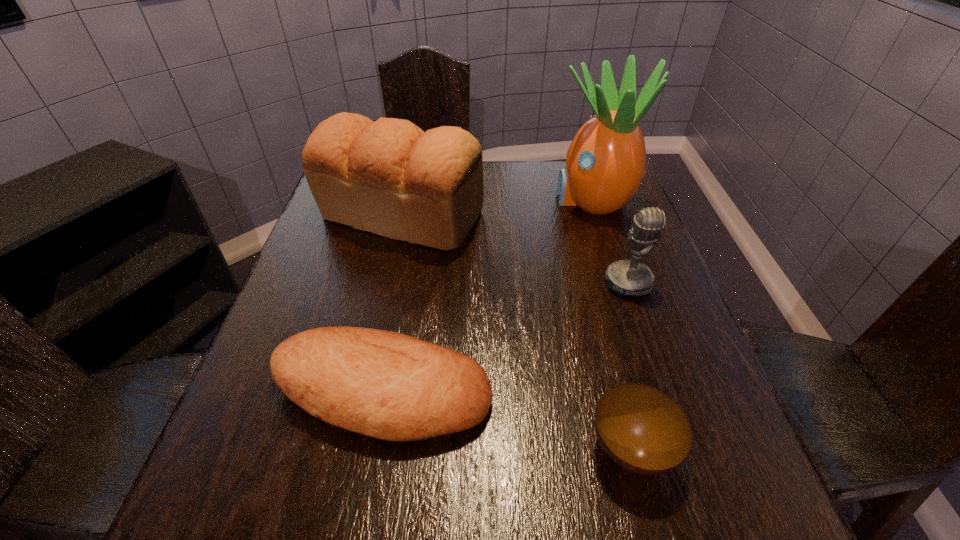
Where is `bowl that is at the right edge`? bowl that is at the right edge is located at coordinates (641, 429).

Identify the location of object positioned at the far left corner. (389, 177).

This screenshot has width=960, height=540. In order to click on object positioned at the far right corner in this screenshot , I will do [x=606, y=162].

What are the coordinates of `object at the near right corner` in the screenshot? It's located at (641, 429).

I want to click on free point at the far edge, so click(x=501, y=186).

At what (x,y) coordinates should I click in order to perform the action: click on vacant space at the near edge of the desktop. Please return your answer as a coordinate pair (x, y). Looking at the image, I should click on (376, 525).

Where is `free space at the left edge of the desktop`? The image size is (960, 540). free space at the left edge of the desktop is located at coordinates (337, 236).

Where is `vacant space at the right edge of the desktop`? vacant space at the right edge of the desktop is located at coordinates (645, 261).

I want to click on blank region between the nearer bread and the taller bread, so click(x=392, y=304).

You are a GUI agent. You are given a task and a screenshot of the screen. Output one action in this format:
    pyautogui.click(x=<x>, y=<y>)
    Task: Click on the free space between the third shortest object and the tallest object
    This screenshot has width=960, height=540.
    Given the screenshot: What is the action you would take?
    pyautogui.click(x=610, y=241)